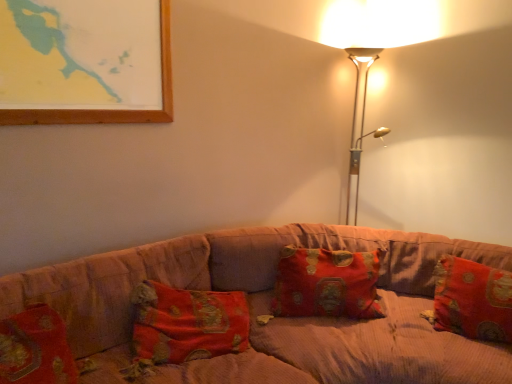
What do you see at coordinates (269, 309) in the screenshot? This screenshot has width=512, height=384. I see `corduroy fabric couch at center` at bounding box center [269, 309].

The image size is (512, 384). Identify the location of metallic gold floor lamp at upper right. (373, 50).

Consider the image. Can you confirm if red brocade pillow at right, which ranks as the 1th pillow in right-to-left order, is thinner than red brocade pillow at center, acting as the second pillow starting from the right?

Indeed, red brocade pillow at right, which ranks as the 1th pillow in right-to-left order, has a lesser width compared to red brocade pillow at center, acting as the second pillow starting from the right.

Who is bigger, red brocade pillow at right, the 2th pillow positioned from the left, or red brocade pillow at center, acting as the second pillow starting from the right?

Bigger between the two is red brocade pillow at center, acting as the second pillow starting from the right.

Does red brocade pillow at right, which ranks as the 1th pillow in right-to-left order, have a greater height compared to red brocade pillow at center, which appears as the 1th pillow when viewed from the left?

No.

How much distance is there between red brocade pillow at right, the 2th pillow positioned from the left, and red brocade pillow at center, which appears as the 1th pillow when viewed from the left?

19.02 inches.

From a real-world perspective, is corduroy fabric couch at center physically above red brocade pillow at center, acting as the second pillow starting from the right?

Incorrect, from a real-world perspective, corduroy fabric couch at center is lower than red brocade pillow at center, acting as the second pillow starting from the right.

Does corduroy fabric couch at center appear on the right side of red brocade pillow at center, acting as the second pillow starting from the right?

No.

Are corduroy fabric couch at center and red brocade pillow at center, acting as the second pillow starting from the right, making contact?

No, corduroy fabric couch at center is not in contact with red brocade pillow at center, acting as the second pillow starting from the right.

Is red brocade pillow at right, the 2th pillow positioned from the left, not inside corduroy fabric couch at center?

That's incorrect, red brocade pillow at right, the 2th pillow positioned from the left, is not completely outside corduroy fabric couch at center.

Is point (441, 302) less distant than point (341, 322)?

That is False.

Is red brocade pillow at right, which ranks as the 1th pillow in right-to-left order, facing away from corduroy fabric couch at center?

Absolutely, red brocade pillow at right, which ranks as the 1th pillow in right-to-left order, is directed away from corduroy fabric couch at center.

Is red brocade pillow at right, which ranks as the 1th pillow in right-to-left order, positioned far away from corduroy fabric couch at center?

No.

Could you tell me if metallic gold floor lamp at upper right is facing red brocade pillow at right, the 2th pillow positioned from the left?

No, metallic gold floor lamp at upper right is not aimed at red brocade pillow at right, the 2th pillow positioned from the left.

From a real-world perspective, who is located higher, metallic gold floor lamp at upper right or red brocade pillow at right, which ranks as the 1th pillow in right-to-left order?

metallic gold floor lamp at upper right.

In the scene shown: Which is farther, (358, 67) or (456, 272)?

The point (358, 67) is more distant.

From the image's perspective, is corduroy fabric couch at center above or below red brocade pillow at right, which ranks as the 1th pillow in right-to-left order?

From the image's perspective, corduroy fabric couch at center appears below red brocade pillow at right, which ranks as the 1th pillow in right-to-left order.

Considering the relative sizes of corduroy fabric couch at center and red brocade pillow at right, the 2th pillow positioned from the left, in the image provided, is corduroy fabric couch at center shorter than red brocade pillow at right, the 2th pillow positioned from the left,?

No, corduroy fabric couch at center is not shorter than red brocade pillow at right, the 2th pillow positioned from the left.

In the scene shown: Does corduroy fabric couch at center have a lesser width compared to red brocade pillow at right, the 2th pillow positioned from the left?

No, corduroy fabric couch at center is not thinner than red brocade pillow at right, the 2th pillow positioned from the left.

From a real-world perspective, is corduroy fabric couch at center above or below red brocade pillow at right, which ranks as the 1th pillow in right-to-left order?

From a real-world perspective, corduroy fabric couch at center is physically below red brocade pillow at right, which ranks as the 1th pillow in right-to-left order.

Can you confirm if red brocade pillow at center, which appears as the 1th pillow when viewed from the left, is smaller than red brocade pillow at right, the 2th pillow positioned from the left?

Actually, red brocade pillow at center, which appears as the 1th pillow when viewed from the left, might be larger than red brocade pillow at right, the 2th pillow positioned from the left.

Is point (315, 294) positioned behind point (451, 272)?

That is False.

Does red brocade pillow at center, which appears as the 1th pillow when viewed from the left, contain red brocade pillow at right, the 2th pillow positioned from the left?

No, red brocade pillow at right, the 2th pillow positioned from the left, is not inside red brocade pillow at center, which appears as the 1th pillow when viewed from the left.

From the image's perspective, is red brocade pillow at center, which appears as the 1th pillow when viewed from the left, on red brocade pillow at right, which ranks as the 1th pillow in right-to-left order?

Correct, red brocade pillow at center, which appears as the 1th pillow when viewed from the left, appears higher than red brocade pillow at right, which ranks as the 1th pillow in right-to-left order, in the image.

Locate an element on the screen. The image size is (512, 384). lamp above the red brocade pillow at right, which ranks as the 1th pillow in right-to-left order (from a real-world perspective) is located at coordinates (373, 50).

Is red brocade pillow at right, which ranks as the 1th pillow in right-to-left order, next to metallic gold floor lamp at upper right?

They are not placed beside each other.

Which of these two, red brocade pillow at right, the 2th pillow positioned from the left, or metallic gold floor lamp at upper right, is smaller?

red brocade pillow at right, the 2th pillow positioned from the left, is smaller.

Would you say red brocade pillow at right, which ranks as the 1th pillow in right-to-left order, is inside or outside metallic gold floor lamp at upper right?

red brocade pillow at right, which ranks as the 1th pillow in right-to-left order, is located beyond the bounds of metallic gold floor lamp at upper right.

The height and width of the screenshot is (384, 512). What are the coordinates of `pillow that is under the red brocade pillow at center, which appears as the 1th pillow when viewed from the left (from a real-world perspective)` in the screenshot? It's located at (472, 300).

This screenshot has width=512, height=384. I want to click on the 2nd pillow positioned above the corduroy fabric couch at center (from the image's perspective), so click(x=327, y=283).

In the scene shown: Looking at the image, which one is located closer to red brocade pillow at right, which ranks as the 1th pillow in right-to-left order, red brocade pillow at center, acting as the second pillow starting from the right, or corduroy fabric couch at center?

corduroy fabric couch at center lies closer to red brocade pillow at right, which ranks as the 1th pillow in right-to-left order, than the other object.

Considering their positions, is red brocade pillow at center, which appears as the 1th pillow when viewed from the left, positioned further to metallic gold floor lamp at upper right than red brocade pillow at right, the 2th pillow positioned from the left?

red brocade pillow at right, the 2th pillow positioned from the left, lies further to metallic gold floor lamp at upper right than the other object.

Considering their positions, is red brocade pillow at right, the 2th pillow positioned from the left, positioned closer to red brocade pillow at center, acting as the second pillow starting from the right, than corduroy fabric couch at center?

Among the two, corduroy fabric couch at center is located nearer to red brocade pillow at center, acting as the second pillow starting from the right.

Which object lies nearer to the anchor point corduroy fabric couch at center, red brocade pillow at center, which appears as the 1th pillow when viewed from the left, or red brocade pillow at right, which ranks as the 1th pillow in right-to-left order?

red brocade pillow at center, which appears as the 1th pillow when viewed from the left, lies closer to corduroy fabric couch at center than the other object.

Considering their positions, is metallic gold floor lamp at upper right positioned closer to red brocade pillow at center, which appears as the 1th pillow when viewed from the left, than corduroy fabric couch at center?

corduroy fabric couch at center lies closer to red brocade pillow at center, which appears as the 1th pillow when viewed from the left, than the other object.

From the image, which object appears to be farther from red brocade pillow at center, acting as the second pillow starting from the right, red brocade pillow at right, the 2th pillow positioned from the left, or metallic gold floor lamp at upper right?

metallic gold floor lamp at upper right is further to red brocade pillow at center, acting as the second pillow starting from the right.

When comparing their distances from metallic gold floor lamp at upper right, does red brocade pillow at right, which ranks as the 1th pillow in right-to-left order, or corduroy fabric couch at center seem further?

corduroy fabric couch at center is positioned further to the anchor metallic gold floor lamp at upper right.

When comparing their distances from red brocade pillow at center, which appears as the 1th pillow when viewed from the left, does corduroy fabric couch at center or red brocade pillow at right, the 2th pillow positioned from the left, seem closer?

corduroy fabric couch at center lies closer to red brocade pillow at center, which appears as the 1th pillow when viewed from the left, than the other object.

Locate an element on the screen. This screenshot has width=512, height=384. pillow between metallic gold floor lamp at upper right and red brocade pillow at right, the 2th pillow positioned from the left, in the up-down direction is located at coordinates (327, 283).

At what (x,y) coordinates should I click in order to perform the action: click on pillow positioned between corduroy fabric couch at center and red brocade pillow at center, acting as the second pillow starting from the right, from near to far. Please return your answer as a coordinate pair (x, y). The image size is (512, 384). Looking at the image, I should click on (472, 300).